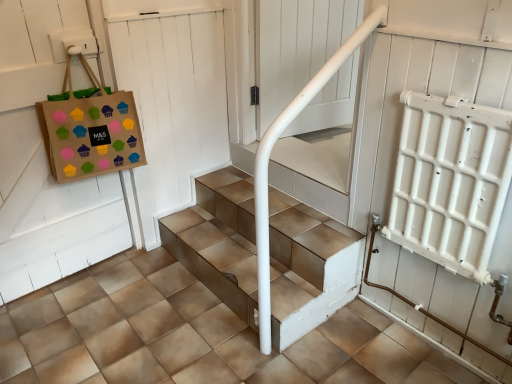
Question: Is white wooden door at upper left spatially inside white glossy handrail at upper center, or outside of it?

Choices:
 (A) outside
 (B) inside

Answer: (A)

Question: Is white wooden door at upper left to the left or to the right of white glossy handrail at upper center in the image?

Choices:
 (A) left
 (B) right

Answer: (A)

Question: Which object is positioned farthest from the brown paper bag with colorful cupcake stickers at upper left?

Choices:
 (A) brown tile concrete at center
 (B) white wooden door at upper left
 (C) white glossy handrail at upper center
 (D) metallic tile stairs at center

Answer: (C)

Question: Which object is positioned farthest from the white wooden door at upper left?

Choices:
 (A) brown tile concrete at center
 (B) brown paper bag with colorful cupcake stickers at upper left
 (C) metallic tile stairs at center
 (D) white glossy handrail at upper center

Answer: (A)